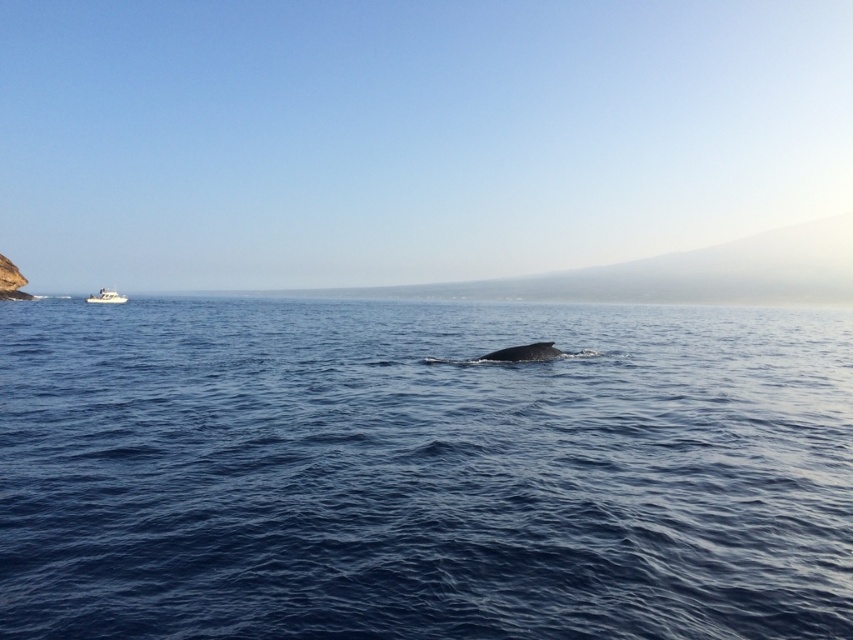
Question: Considering the relative positions of gray matte whale at center and white plastic boat at left in the image provided, where is gray matte whale at center located with respect to white plastic boat at left?

Choices:
 (A) below
 (B) above

Answer: (A)

Question: Is the position of gray matte whale at center more distant than that of white plastic boat at left?

Choices:
 (A) no
 (B) yes

Answer: (A)

Question: Is gray matte whale at center further to camera compared to white plastic boat at left?

Choices:
 (A) no
 (B) yes

Answer: (A)

Question: Which object is farther from the camera taking this photo?

Choices:
 (A) gray matte whale at center
 (B) blue water at center
 (C) white plastic boat at left

Answer: (C)

Question: Which of the following is the farthest from the observer?

Choices:
 (A) gray matte whale at center
 (B) blue water at center
 (C) white plastic boat at left

Answer: (C)

Question: Which is farther from the gray matte whale at center?

Choices:
 (A) blue water at center
 (B) white plastic boat at left

Answer: (B)